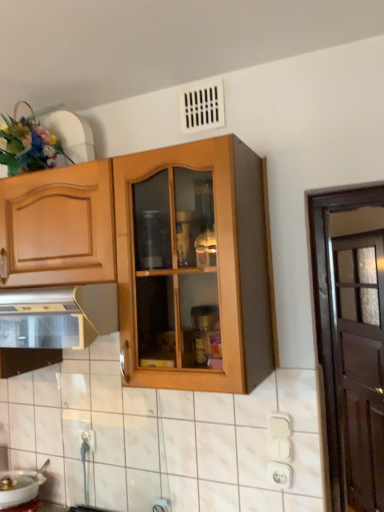
Question: Is point (331, 194) closer or farther from the camera than point (29, 144)?

Choices:
 (A) farther
 (B) closer

Answer: (B)

Question: From a real-world perspective, is brown wooden door at right physically located above or below fluffy floral bouquet at upper left?

Choices:
 (A) above
 (B) below

Answer: (B)

Question: Which object is the farthest from the white glossy sink at lower left?

Choices:
 (A) brown wooden door at right
 (B) white plastic electric outlet at lower right, which ranks as the first electric outlet in right-to-left order
 (C) metallic stainless steel oven at lower left
 (D) fluffy floral bouquet at upper left
 (E) white plastic electric outlet at lower center, the second electric outlet when ordered from front to back

Answer: (D)

Question: Estimate the real-world distances between objects in this image. Which object is farther from the white plastic electric outlet at lower right, marked as the second electric outlet in a left-to-right arrangement?

Choices:
 (A) white glossy sink at lower left
 (B) brown wooden door at right
 (C) fluffy floral bouquet at upper left
 (D) white plastic electric outlet at lower center, the first electric outlet in the left-to-right sequence
 (E) metallic stainless steel oven at lower left

Answer: (C)